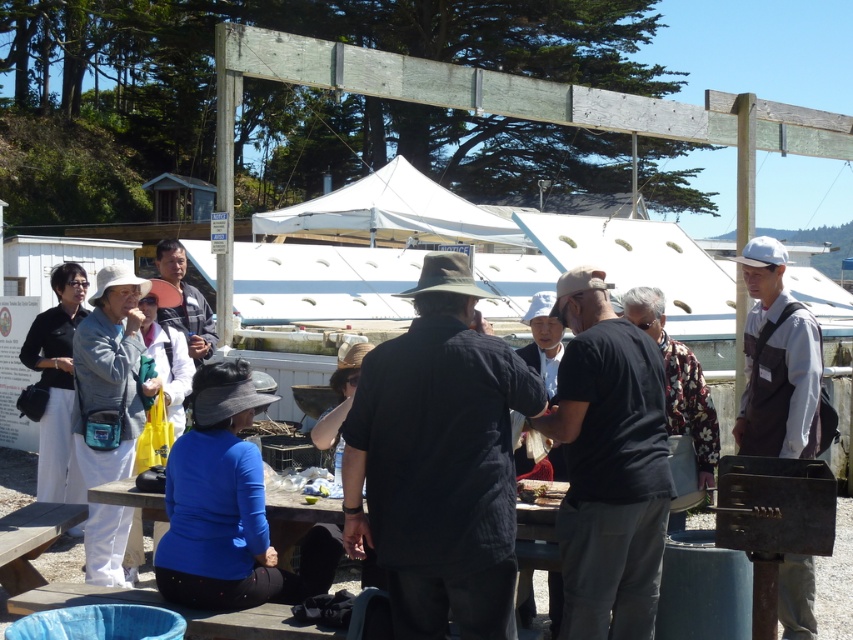
You are at a community event near a waterfront with boats and a white tent in the background. You see two points marked on the ground labeled as point 1 at coordinates (807, 564) and point 2 at coordinates (181, 321). If you are facing the waterfront, which point is closer to you?

Point 1 at coordinates (807, 564) is in front of point 2 at coordinates (181, 321), so if you are facing the waterfront, point 1 is closer to you.

You are organizing a clothing donation drive and need to categorize items by size. You see the white cotton shirt at right and the matte black jacket at center. Which clothing item is bigger in size?

The white cotton shirt at right has a larger size compared to the matte black jacket at center, so the white cotton shirt at right is bigger.